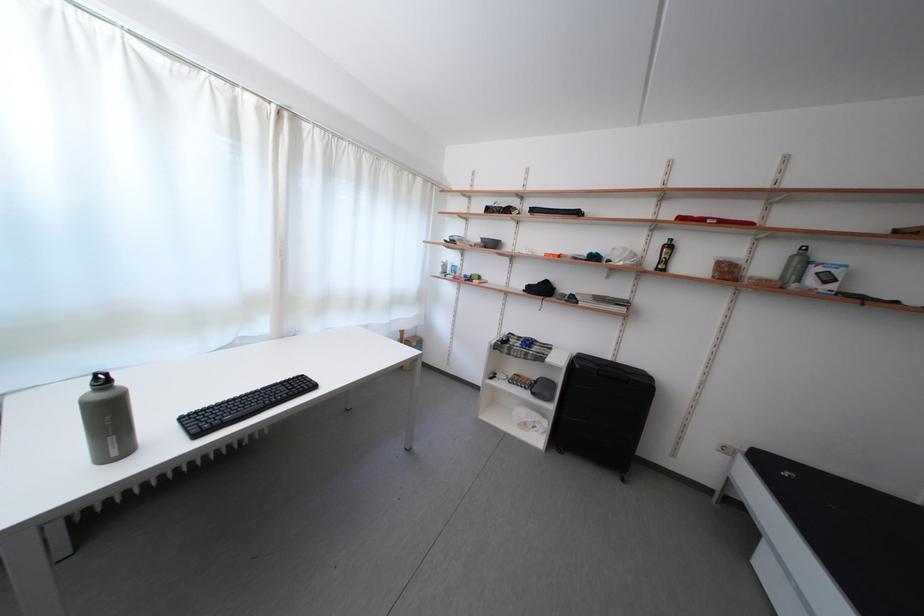
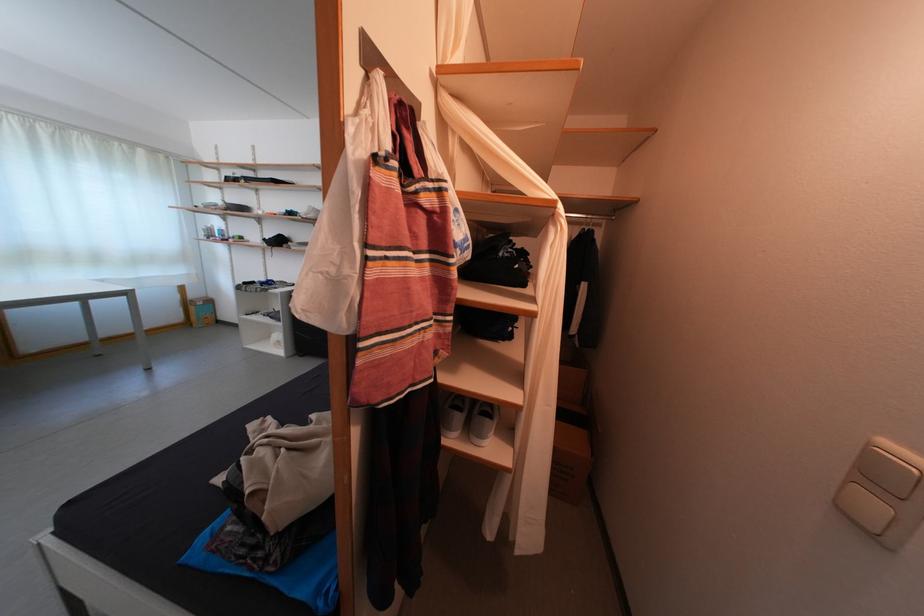
What movement of the cameraman would produce the second image?

The movement direction of the cameraman is right, backward.